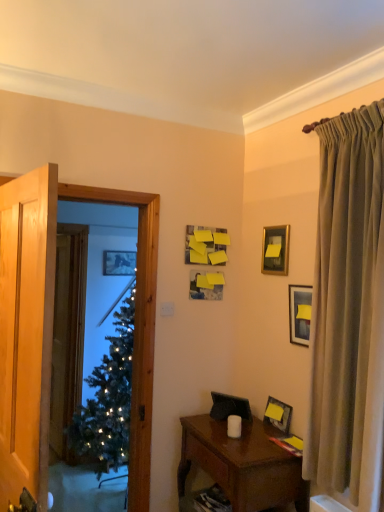
Describe the element at coordinates (275, 250) in the screenshot. I see `gold metallic picture frame at upper right, the 4th picture frame viewed from the left` at that location.

Describe the element at coordinates (234, 426) in the screenshot. The height and width of the screenshot is (512, 384). I see `white matte candle at center` at that location.

Measure the distance between point (274,500) and camera.

Point (274,500) and camera are 2.05 meters apart from each other.

Identify the location of metallic silver picture frame at upper left, placed as the fourth picture frame when sorted from bottom to top. Image resolution: width=384 pixels, height=512 pixels. [119, 263].

Is brown wooden nightstand at lower right inside metallic silver picture frame at upper left, which is the 2th picture frame in top-to-bottom order?

That's incorrect, brown wooden nightstand at lower right is not inside metallic silver picture frame at upper left, which is the 2th picture frame in top-to-bottom order.

From the image's perspective, is metallic silver picture frame at upper left, arranged as the first picture frame when viewed from the left, located above brown wooden nightstand at lower right?

Yes.

Considering the sizes of objects metallic silver picture frame at upper left, arranged as the first picture frame when viewed from the left, and brown wooden nightstand at lower right in the image provided, who is taller, metallic silver picture frame at upper left, arranged as the first picture frame when viewed from the left, or brown wooden nightstand at lower right?

Standing taller between the two is brown wooden nightstand at lower right.

How different are the orientations of metallic silver picture frame at upper left, which is the 2th picture frame in top-to-bottom order, and brown wooden nightstand at lower right in degrees?

The angle between the facing direction of metallic silver picture frame at upper left, which is the 2th picture frame in top-to-bottom order, and the facing direction of brown wooden nightstand at lower right is 91.2 degrees.

Would you consider yellow matte picture frame at upper center, which ranks as the second picture frame in back-to-front order, to be distant from green frosted glass window screen at left?

That's not correct — yellow matte picture frame at upper center, which ranks as the second picture frame in back-to-front order, is a little close to green frosted glass window screen at left.

Considering the points (200, 281) and (147, 456), which point is in front, point (200, 281) or point (147, 456)?

The point (147, 456) is closer to the camera.

Considering the sizes of objects yellow matte picture frame at upper center, acting as the 2th picture frame starting from the left, and green frosted glass window screen at left in the image provided, who is shorter, yellow matte picture frame at upper center, acting as the 2th picture frame starting from the left, or green frosted glass window screen at left?

yellow matte picture frame at upper center, acting as the 2th picture frame starting from the left, is shorter.

From a real-world perspective, is green frosted glass window screen at left located higher than brown wooden nightstand at lower right?

Correct, in the physical world, green frosted glass window screen at left is higher than brown wooden nightstand at lower right.

Which object is positioned more to the right, green frosted glass window screen at left or brown wooden nightstand at lower right?

Positioned to the right is brown wooden nightstand at lower right.

Can we say green frosted glass window screen at left lies outside brown wooden nightstand at lower right?

Yes, green frosted glass window screen at left is located beyond the bounds of brown wooden nightstand at lower right.

From the image's perspective, would you say green frosted glass window screen at left is shown under brown wooden nightstand at lower right?

No, from the image's perspective, green frosted glass window screen at left is not beneath brown wooden nightstand at lower right.

Is brown wooden nightstand at lower right shorter than yellow matte picture frame at upper center, which ranks as the 3th picture frame in top-to-bottom order?

No, brown wooden nightstand at lower right is not shorter than yellow matte picture frame at upper center, which ranks as the 3th picture frame in top-to-bottom order.

Where is `nightstand located underneath the yellow matte picture frame at upper center, acting as the 2th picture frame starting from the left (from a real-world perspective)`? nightstand located underneath the yellow matte picture frame at upper center, acting as the 2th picture frame starting from the left (from a real-world perspective) is located at coordinates (242, 464).

Considering the positions of point (198, 458) and point (221, 294), is point (198, 458) closer or farther from the camera than point (221, 294)?

Point (198, 458) appears to be closer to the viewer than point (221, 294).

From the image's perspective, is yellow matte picture frame at upper center, marked as the fourth picture frame in a right-to-left arrangement, above brown wooden nightstand at lower right?

Indeed, from the image's perspective, yellow matte picture frame at upper center, marked as the fourth picture frame in a right-to-left arrangement, is shown above brown wooden nightstand at lower right.

Is point (220, 286) closer or farther from the camera than point (192, 441)?

Point (220, 286) is positioned farther from the camera compared to point (192, 441).

Considering the positions of objects yellow matte picture frame at upper center, which is the 3th picture frame in bottom-to-top order, and brown wooden nightstand at lower right in the image provided, who is more to the right, yellow matte picture frame at upper center, which is the 3th picture frame in bottom-to-top order, or brown wooden nightstand at lower right?

Positioned to the right is brown wooden nightstand at lower right.

Starting from the metallic silver picture frame at upper left, marked as the 5th picture frame in a front-to-back arrangement, which picture frame is the 3rd one in front? Please provide its 2D coordinates.

[(278, 414)]

How different are the orientations of metallic silver picture frame at upper left, which is the 2th picture frame in top-to-bottom order, and matte black picture frame at right, placed as the 1th picture frame when sorted from bottom to top, in degrees?

The facing directions of metallic silver picture frame at upper left, which is the 2th picture frame in top-to-bottom order, and matte black picture frame at right, placed as the 1th picture frame when sorted from bottom to top, are 86.1 degrees apart.

From a real-world perspective, is metallic silver picture frame at upper left, placed as the first picture frame when sorted from back to front, on top of matte black picture frame at right, the third picture frame viewed from the right?

Yes.

Does metallic silver picture frame at upper left, placed as the fourth picture frame when sorted from bottom to top, lie in front of matte black picture frame at right, the 2th picture frame when ordered from front to back?

No, metallic silver picture frame at upper left, placed as the fourth picture frame when sorted from bottom to top, is further to the viewer.

Looking at this image, is yellow matte picture frame at upper center, the 4th picture frame from the front, turned away from matte black picture frame at right, the 4th picture frame in the back-to-front sequence?

That's not correct — yellow matte picture frame at upper center, the 4th picture frame from the front, is not looking away from matte black picture frame at right, the 4th picture frame in the back-to-front sequence.

Is yellow matte picture frame at upper center, the 4th picture frame from the front, placed right next to matte black picture frame at right, the third picture frame viewed from the right?

No, yellow matte picture frame at upper center, the 4th picture frame from the front, is not in contact with matte black picture frame at right, the third picture frame viewed from the right.

Looking at the image, does yellow matte picture frame at upper center, which is the 3th picture frame in bottom-to-top order, seem bigger or smaller compared to matte black picture frame at right, the 4th picture frame in the back-to-front sequence?

In the image, yellow matte picture frame at upper center, which is the 3th picture frame in bottom-to-top order, appears to be smaller than matte black picture frame at right, the 4th picture frame in the back-to-front sequence.

The image size is (384, 512). Find the location of `picture frame that is the 4th object located above the brown wooden nightstand at lower right (from the image's perspective)`. picture frame that is the 4th object located above the brown wooden nightstand at lower right (from the image's perspective) is located at coordinates (119, 263).

The width and height of the screenshot is (384, 512). I want to click on the 2nd picture frame positioned above the green frosted glass window screen at left (from a real-world perspective), so click(x=205, y=286).

Which object lies further to the anchor point matte black picture frame at right, the 2th picture frame when ordered from front to back, silky beige curtain at right or yellow matte picture frame at upper right, which is the 2th picture frame from bottom to top?

silky beige curtain at right is further to matte black picture frame at right, the 2th picture frame when ordered from front to back.

Which object lies further to the anchor point brown wooden nightstand at lower right, metallic silver picture frame at upper left, marked as the 5th picture frame in a front-to-back arrangement, or matte black picture frame at right, the 2th picture frame when ordered from front to back?

Based on the image, metallic silver picture frame at upper left, marked as the 5th picture frame in a front-to-back arrangement, appears to be further to brown wooden nightstand at lower right.

Which object lies nearer to the anchor point silky beige curtain at right, green frosted glass window screen at left or matte black picture frame at right, placed as the 1th picture frame when sorted from bottom to top?

matte black picture frame at right, placed as the 1th picture frame when sorted from bottom to top, lies closer to silky beige curtain at right than the other object.

When comparing their distances from gold metallic picture frame at upper right, the 5th picture frame when ordered from bottom to top, does green frosted glass window screen at left or silky beige curtain at right seem closer?

silky beige curtain at right is positioned closer to the anchor gold metallic picture frame at upper right, the 5th picture frame when ordered from bottom to top.

From the image, which object appears to be nearer to metallic silver picture frame at upper left, placed as the fourth picture frame when sorted from bottom to top, brown wooden nightstand at lower right or yellow matte picture frame at upper center, which is the 3th picture frame in bottom-to-top order?

yellow matte picture frame at upper center, which is the 3th picture frame in bottom-to-top order.

Estimate the real-world distances between objects in this image. Which object is further from metallic silver picture frame at upper left, the fifth picture frame in the right-to-left sequence, brown wooden nightstand at lower right or silky beige curtain at right?

The object further to metallic silver picture frame at upper left, the fifth picture frame in the right-to-left sequence, is silky beige curtain at right.

Which object lies nearer to the anchor point brown wooden nightstand at lower right, silky beige curtain at right or green frosted glass window screen at left?

silky beige curtain at right lies closer to brown wooden nightstand at lower right than the other object.

Based on their spatial positions, is silky beige curtain at right or metallic silver picture frame at upper left, the fifth picture frame in the right-to-left sequence, closer to green frosted glass window screen at left?

silky beige curtain at right is positioned closer to the anchor green frosted glass window screen at left.

Where is `nightstand located between green frosted glass window screen at left and yellow matte picture frame at upper right, the fifth picture frame positioned from the left, in the left-right direction`? The width and height of the screenshot is (384, 512). nightstand located between green frosted glass window screen at left and yellow matte picture frame at upper right, the fifth picture frame positioned from the left, in the left-right direction is located at coordinates (242, 464).

The image size is (384, 512). Identify the location of nightstand between green frosted glass window screen at left and matte black picture frame at right, acting as the third picture frame starting from the left, in the horizontal direction. (242, 464).

The image size is (384, 512). I want to click on tableware between yellow matte picture frame at upper right, positioned as the 4th picture frame in top-to-bottom order, and brown wooden nightstand at lower right in the up-down direction, so click(234, 426).

In order to click on window screen between yellow matte picture frame at upper center, marked as the fourth picture frame in a right-to-left arrangement, and metallic silver picture frame at upper left, the fifth picture frame in the right-to-left sequence, from front to back in this screenshot , I will do `click(136, 327)`.